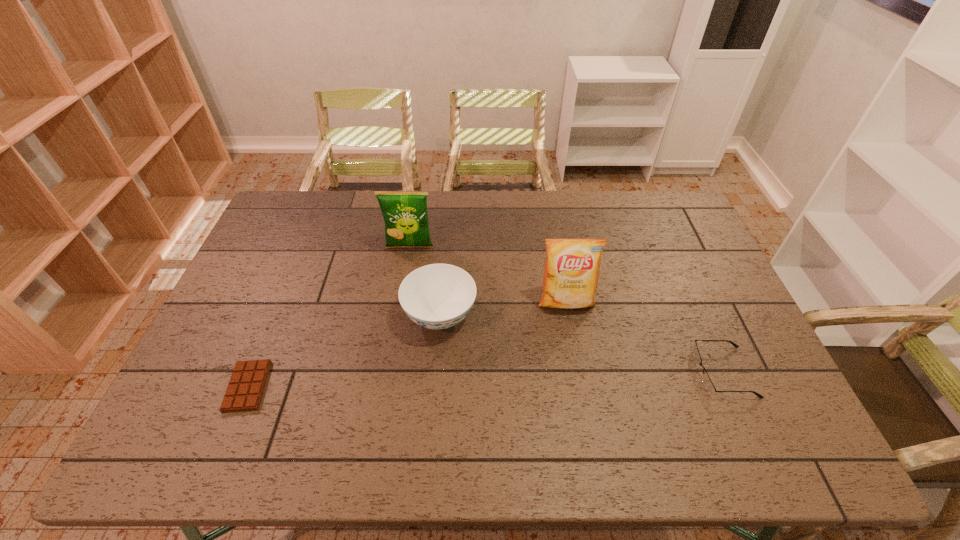
I want to click on the second object from right to left, so click(x=572, y=266).

Where is `the right crisp (potato chip)`? This screenshot has width=960, height=540. the right crisp (potato chip) is located at coordinates (572, 266).

Where is `the left crisp (potato chip)`? The width and height of the screenshot is (960, 540). the left crisp (potato chip) is located at coordinates (405, 214).

Image resolution: width=960 pixels, height=540 pixels. In order to click on the farthest object in this screenshot , I will do `click(405, 214)`.

This screenshot has width=960, height=540. Identify the location of the third tallest object. (437, 296).

This screenshot has height=540, width=960. Find the location of `the second shortest object`. the second shortest object is located at coordinates (707, 382).

At what (x,y) coordinates should I click in order to perform the action: click on the rightmost object. Please return your answer as a coordinate pair (x, y). The height and width of the screenshot is (540, 960). Looking at the image, I should click on (707, 382).

You are a GUI agent. You are given a task and a screenshot of the screen. Output one action in this format:
    pyautogui.click(x=<x>, y=<y>)
    Task: Click on the shortest object
    Image resolution: width=960 pixels, height=540 pixels.
    Given the screenshot: What is the action you would take?
    pyautogui.click(x=247, y=383)

Find the location of a particular element. This screenshot has height=540, width=960. candy bar is located at coordinates (247, 383).

At what (x,y) coordinates should I click in order to perform the action: click on free space located 0.050m on the front-facing side of the fourth object from left to right. Please return your answer as a coordinate pair (x, y). Looking at the image, I should click on pyautogui.click(x=571, y=329).